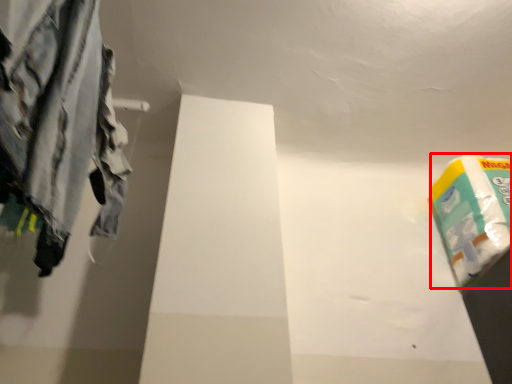
Question: From the image's perspective, what is the correct spatial relationship of toilet paper (annotated by the red box) in relation to trousers?

Choices:
 (A) below
 (B) above

Answer: (A)